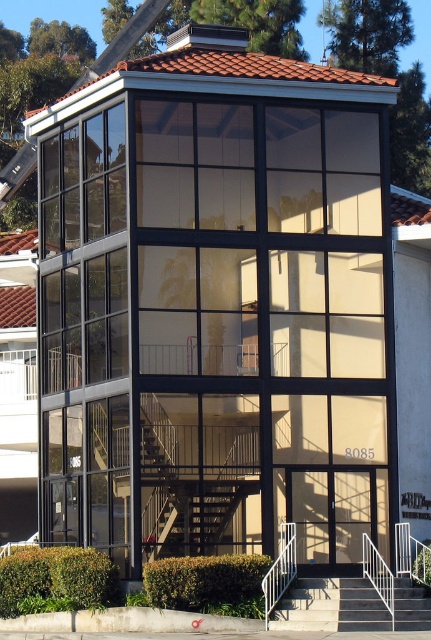
Does concrete/steps at center have a greater height compared to white metal railing at lower center?

No.

Find the location of a particular element. The height and width of the screenshot is (640, 431). concrete/steps at center is located at coordinates (331, 605).